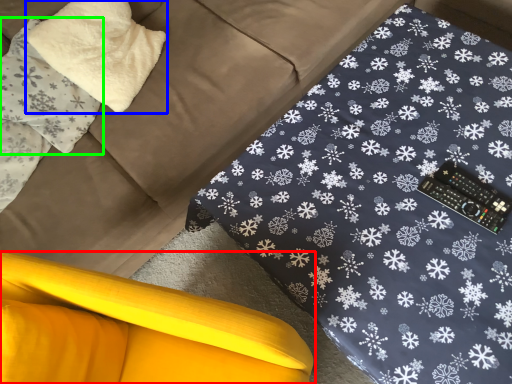
Question: Which is farther away from furniture (highlighted by a red box)? pillow (highlighted by a blue box) or pillow (highlighted by a green box)?

Choices:
 (A) pillow
 (B) pillow

Answer: (A)